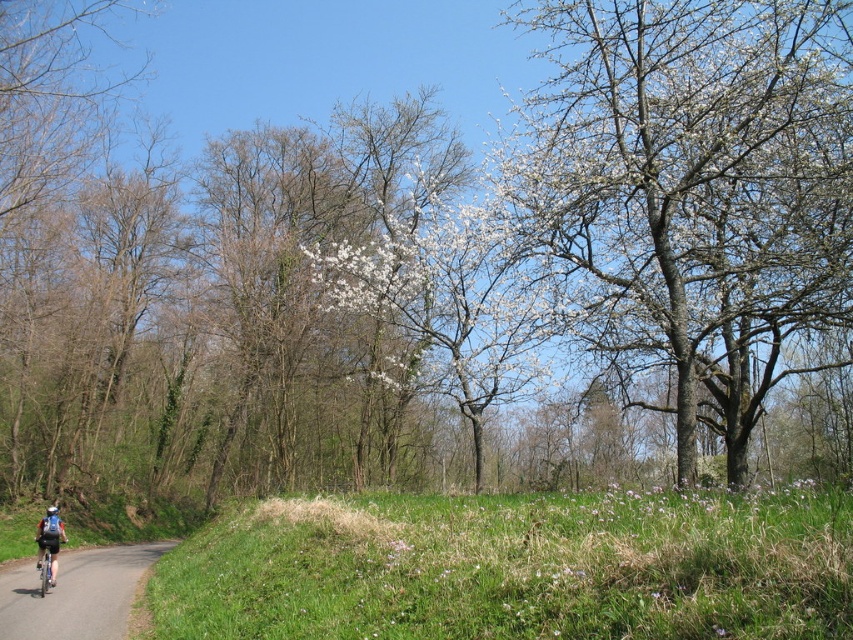
You are a delivery person who needs to place a package on the smooth asphalt road at lower left. However, there is a dark blue fabric backpack at lower left in the way. Can you move the backpack to the side to make space for the package?

The smooth asphalt road at lower left might be wider than dark blue fabric backpack at lower left, so it is possible to move the backpack to the side and create enough space for the package.

You are standing at the center of the image and want to walk to the smooth asphalt road at lower left. Which direction should you head towards?

You should head towards the lower left direction to reach the smooth asphalt road at lower left.

You are a pedestrian standing on the grassy area with small purple flowers. You see the smooth asphalt road at lower left and the blue matte helmet at lower left. Which object is closer to your left side?

The blue matte helmet at lower left is closer to your left side because the smooth asphalt road at lower left is to the right of it.